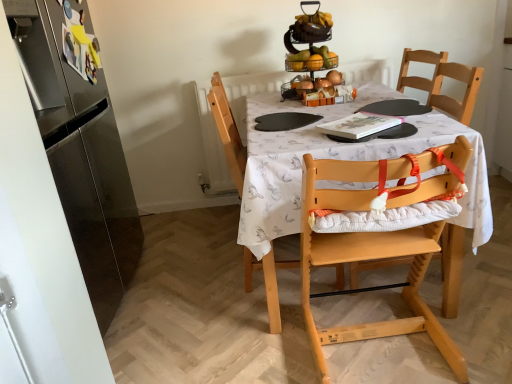
Question: Would you say light wood highchair at center, which is the second chair in front-to-back order, is inside or outside metallic silver fruit basket at upper center?

Choices:
 (A) outside
 (B) inside

Answer: (A)

Question: Considering the positions of light wood highchair at center, which is the second chair in front-to-back order, and metallic silver fruit basket at upper center in the image, is light wood highchair at center, which is the second chair in front-to-back order, bigger or smaller than metallic silver fruit basket at upper center?

Choices:
 (A) big
 (B) small

Answer: (A)

Question: Which is nearer to the metallic silver fruit basket at upper center?

Choices:
 (A) satin silver refrigerator at left
 (B) light wood highchair at center, which is the second chair in front-to-back order
 (C) wooden high chair at center
 (D) light wood highchair at center, positioned as the 2th chair in back-to-front order

Answer: (B)

Question: Estimate the real-world distances between objects in this image. Which object is closer to the satin silver refrigerator at left?

Choices:
 (A) light wood highchair at center, the first chair in the front-to-back sequence
 (B) metallic silver fruit basket at upper center
 (C) light wood highchair at center, which is the second chair in front-to-back order
 (D) wooden high chair at center

Answer: (C)